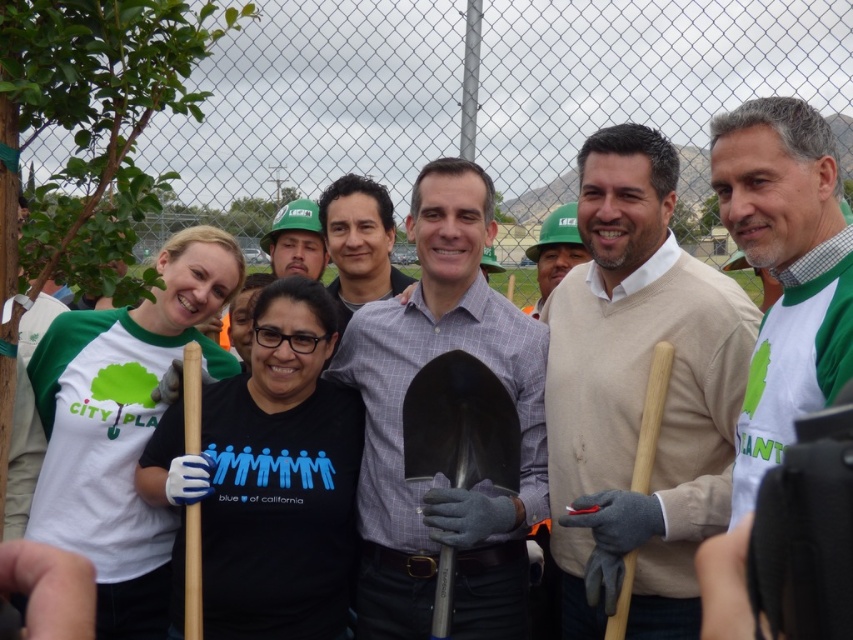
Can you confirm if polished metal shovel at center is wider than matte black shirt at center?

In fact, polished metal shovel at center might be narrower than matte black shirt at center.

Which is in front, point (424, 436) or point (338, 196)?

Point (424, 436)

Between point (508, 449) and point (363, 227), which one is positioned behind?

Positioned behind is point (363, 227).

Find the location of a particular element. This screenshot has height=640, width=853. polished metal shovel at center is located at coordinates (460, 426).

Consider the image. Between gray checkered shirt at center and wooden shovel at right, which one appears on the left side from the viewer's perspective?

Positioned to the left is gray checkered shirt at center.

Describe the element at coordinates (399, 426) in the screenshot. I see `gray checkered shirt at center` at that location.

What do you see at coordinates (399, 426) in the screenshot? I see `gray checkered shirt at center` at bounding box center [399, 426].

Find the location of a particular element. gray checkered shirt at center is located at coordinates (399, 426).

Consider the image. Does green jersey at right appear on the left side of matte black shirt at center?

Incorrect, green jersey at right is not on the left side of matte black shirt at center.

Who is shorter, green jersey at right or matte black shirt at center?

Standing shorter between the two is green jersey at right.

Which is in front, point (810, 141) or point (387, 298)?

Point (810, 141) is in front.

Locate an element on the screen. The width and height of the screenshot is (853, 640). green jersey at right is located at coordinates point(785,269).